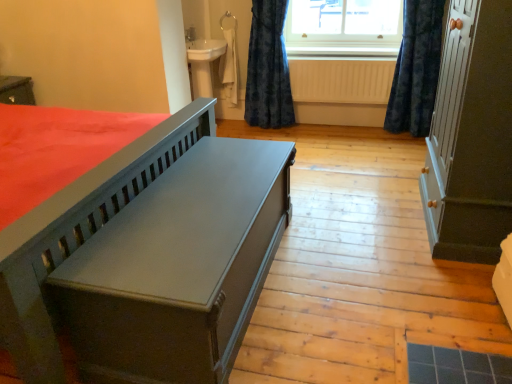
Question: Considering the relative sizes of dark blue velvet curtain at upper right, marked as the 2th curtain in a left-to-right arrangement, and matte gray bench at center in the image provided, is dark blue velvet curtain at upper right, marked as the 2th curtain in a left-to-right arrangement, shorter than matte gray bench at center?

Choices:
 (A) no
 (B) yes

Answer: (A)

Question: Does dark blue velvet curtain at upper right, the 1th curtain in the right-to-left sequence, lie behind matte gray bench at center?

Choices:
 (A) no
 (B) yes

Answer: (B)

Question: Is dark blue velvet curtain at upper right, marked as the 2th curtain in a left-to-right arrangement, to the right of matte gray bench at center from the viewer's perspective?

Choices:
 (A) no
 (B) yes

Answer: (B)

Question: From a real-world perspective, is dark blue velvet curtain at upper right, the 1th curtain in the right-to-left sequence, below matte gray bench at center?

Choices:
 (A) no
 (B) yes

Answer: (A)

Question: Is dark blue velvet curtain at upper right, marked as the 2th curtain in a left-to-right arrangement, far from matte gray bench at center?

Choices:
 (A) yes
 (B) no

Answer: (A)

Question: Considering the positions of dark blue velvet curtain at upper right, the 1th curtain in the right-to-left sequence, and matte gray cabinet at right in the image, is dark blue velvet curtain at upper right, the 1th curtain in the right-to-left sequence, wider or thinner than matte gray cabinet at right?

Choices:
 (A) thin
 (B) wide

Answer: (A)

Question: Considering the positions of point (423, 6) and point (459, 33), is point (423, 6) closer or farther from the camera than point (459, 33)?

Choices:
 (A) farther
 (B) closer

Answer: (A)

Question: Considering the positions of dark blue velvet curtain at upper right, marked as the 2th curtain in a left-to-right arrangement, and matte gray cabinet at right in the image, is dark blue velvet curtain at upper right, marked as the 2th curtain in a left-to-right arrangement, taller or shorter than matte gray cabinet at right?

Choices:
 (A) tall
 (B) short

Answer: (B)

Question: Considering the positions of dark blue velvet curtain at upper right, the 1th curtain in the right-to-left sequence, and matte gray cabinet at right in the image, is dark blue velvet curtain at upper right, the 1th curtain in the right-to-left sequence, bigger or smaller than matte gray cabinet at right?

Choices:
 (A) small
 (B) big

Answer: (A)

Question: Considering their positions, is clear glass window at upper center located in front of or behind matte gray cabinet at right?

Choices:
 (A) front
 (B) behind

Answer: (B)

Question: From the image's perspective, is clear glass window at upper center above or below matte gray cabinet at right?

Choices:
 (A) above
 (B) below

Answer: (A)

Question: Is clear glass window at upper center situated inside matte gray cabinet at right or outside?

Choices:
 (A) inside
 (B) outside

Answer: (B)

Question: Is clear glass window at upper center bigger or smaller than matte gray cabinet at right?

Choices:
 (A) big
 (B) small

Answer: (B)

Question: Is matte gray bench at center inside or outside of dark blue velvet curtain at upper right, marked as the 2th curtain in a left-to-right arrangement?

Choices:
 (A) outside
 (B) inside

Answer: (A)

Question: Considering their positions, is matte gray bench at center located in front of or behind dark blue velvet curtain at upper right, marked as the 2th curtain in a left-to-right arrangement?

Choices:
 (A) behind
 (B) front

Answer: (B)